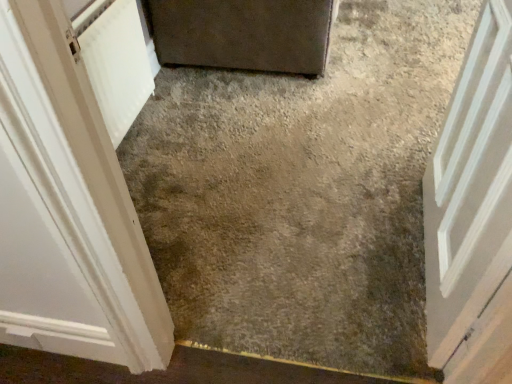
Question: Does gray concrete at center have a greater height compared to white painted wood door at center, which ranks as the 1th door in right-to-left order?

Choices:
 (A) yes
 (B) no

Answer: (B)

Question: Does gray concrete at center lie in front of white painted wood door at center, the 3th door when ordered from left to right?

Choices:
 (A) no
 (B) yes

Answer: (A)

Question: Is gray concrete at center not near white painted wood door at center, which ranks as the 1th door in right-to-left order?

Choices:
 (A) no
 (B) yes

Answer: (A)

Question: From the image's perspective, would you say gray concrete at center is shown under white painted wood door at center, the 3th door when ordered from left to right?

Choices:
 (A) no
 (B) yes

Answer: (A)

Question: Does gray concrete at center have a greater width compared to white painted wood door at center, which ranks as the 1th door in right-to-left order?

Choices:
 (A) no
 (B) yes

Answer: (B)

Question: Is gray concrete at center looking in the opposite direction of white painted wood door at center, the 3th door when ordered from left to right?

Choices:
 (A) no
 (B) yes

Answer: (A)

Question: Is white painted wood door at center, which ranks as the 1th door in right-to-left order, aimed at matte gray door at upper center, which is the 2th door in left-to-right order?

Choices:
 (A) yes
 (B) no

Answer: (B)

Question: Can you confirm if white painted wood door at center, which ranks as the 1th door in right-to-left order, is positioned to the left of matte gray door at upper center, which is the 2th door in left-to-right order?

Choices:
 (A) yes
 (B) no

Answer: (B)

Question: Considering the relative sizes of white painted wood door at center, the 3th door when ordered from left to right, and matte gray door at upper center, which is the 2th door in left-to-right order, in the image provided, is white painted wood door at center, the 3th door when ordered from left to right, thinner than matte gray door at upper center, which is the 2th door in left-to-right order,?

Choices:
 (A) no
 (B) yes

Answer: (B)

Question: Is white painted wood door at center, which ranks as the 1th door in right-to-left order, not within matte gray door at upper center, the 2th door positioned from the right?

Choices:
 (A) no
 (B) yes

Answer: (B)

Question: Considering the relative positions of white painted wood door at center, the 3th door when ordered from left to right, and matte gray door at upper center, the 2th door positioned from the right, in the image provided, is white painted wood door at center, the 3th door when ordered from left to right, behind matte gray door at upper center, the 2th door positioned from the right,?

Choices:
 (A) no
 (B) yes

Answer: (A)

Question: Is white painted wood door at center, the 3th door when ordered from left to right, positioned in front of matte gray door at upper center, the 2th door positioned from the right?

Choices:
 (A) no
 (B) yes

Answer: (B)

Question: From a real-world perspective, is matte gray door at upper center, the 2th door positioned from the right, positioned under white painted wood door at left, the first door in the left-to-right sequence, based on gravity?

Choices:
 (A) yes
 (B) no

Answer: (A)